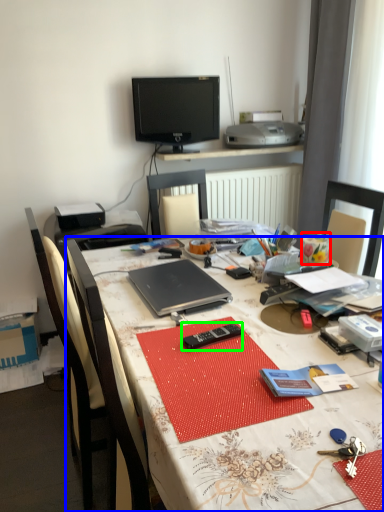
Question: Which is nearer to the stationery (highlighted by a red box)? desk (highlighted by a blue box) or remote (highlighted by a green box).

Choices:
 (A) desk
 (B) remote

Answer: (B)